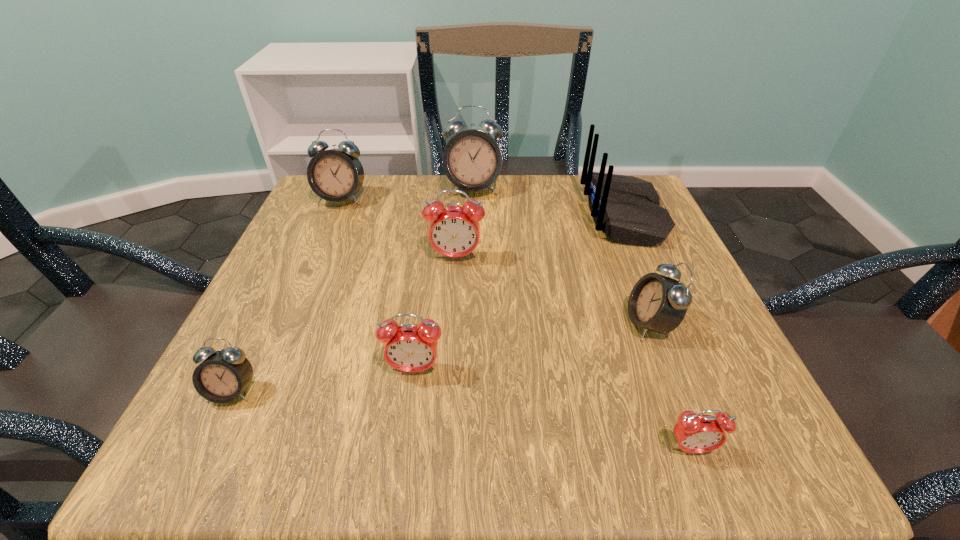
The height and width of the screenshot is (540, 960). In order to click on the third white alarm clock from left to right in this screenshot , I will do `click(472, 160)`.

Find the location of a particular element. This screenshot has width=960, height=540. the tallest alarm clock is located at coordinates (472, 160).

The height and width of the screenshot is (540, 960). What are the coordinates of `black router` in the screenshot? It's located at (627, 207).

Identify the location of the third smallest white alarm clock. The image size is (960, 540). (335, 175).

Locate an element on the screen. the farthest red alarm clock is located at coordinates (454, 231).

Locate an element on the screen. This screenshot has width=960, height=540. the fourth farthest object is located at coordinates (454, 231).

At what (x,y) coordinates should I click in order to perform the action: click on the fourth nearest alarm clock. Please return your answer as a coordinate pair (x, y). Image resolution: width=960 pixels, height=540 pixels. Looking at the image, I should click on (657, 303).

Identify the location of the fourth nearest object. 657,303.

This screenshot has width=960, height=540. I want to click on the second biggest red alarm clock, so click(408, 347).

Find the location of `the smallest white alarm clock`. the smallest white alarm clock is located at coordinates (224, 374).